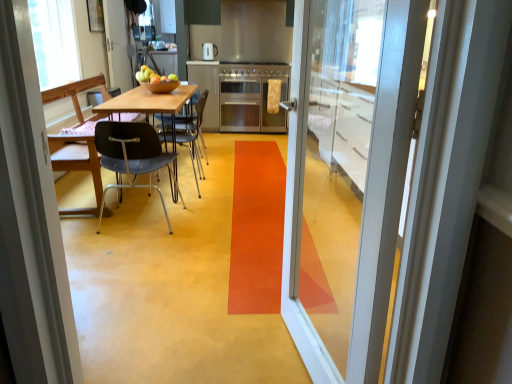
Identify the location of vacant area situated below black plastic chair at left, the second chair viewed from the left (from a real-world perspective). This screenshot has height=384, width=512. (139, 217).